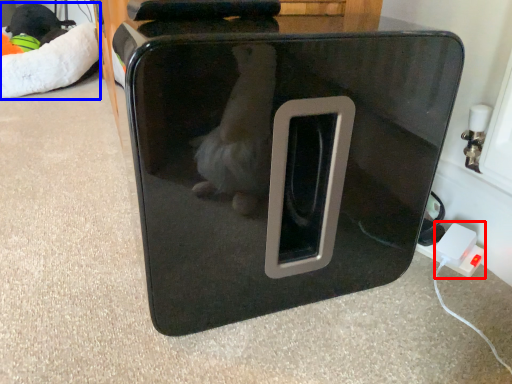
Question: Which of the following is the farthest to the observer, electric outlet (highlighted by a red box) or bean bag chair (highlighted by a blue box)?

Choices:
 (A) electric outlet
 (B) bean bag chair

Answer: (B)